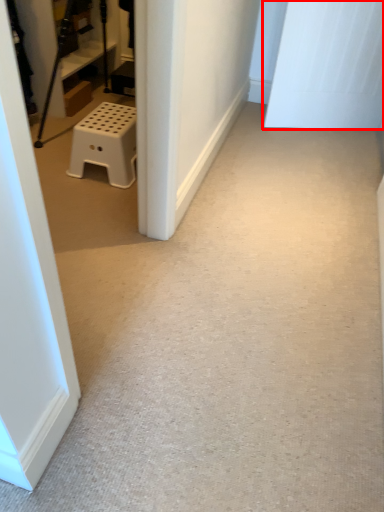
Question: From the image's perspective, where is door (annotated by the red box) located relative to furniture?

Choices:
 (A) above
 (B) below

Answer: (A)